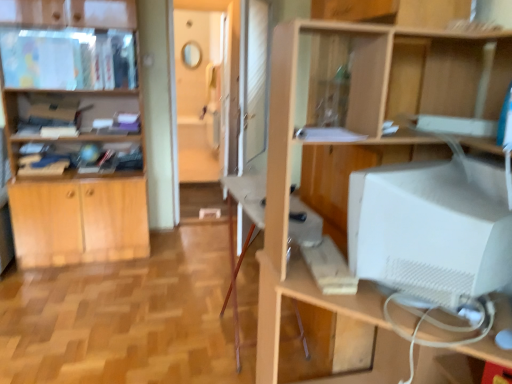
This screenshot has height=384, width=512. Find the location of `unoccupied region to the right of light wood cabinet at left`. unoccupied region to the right of light wood cabinet at left is located at coordinates (179, 264).